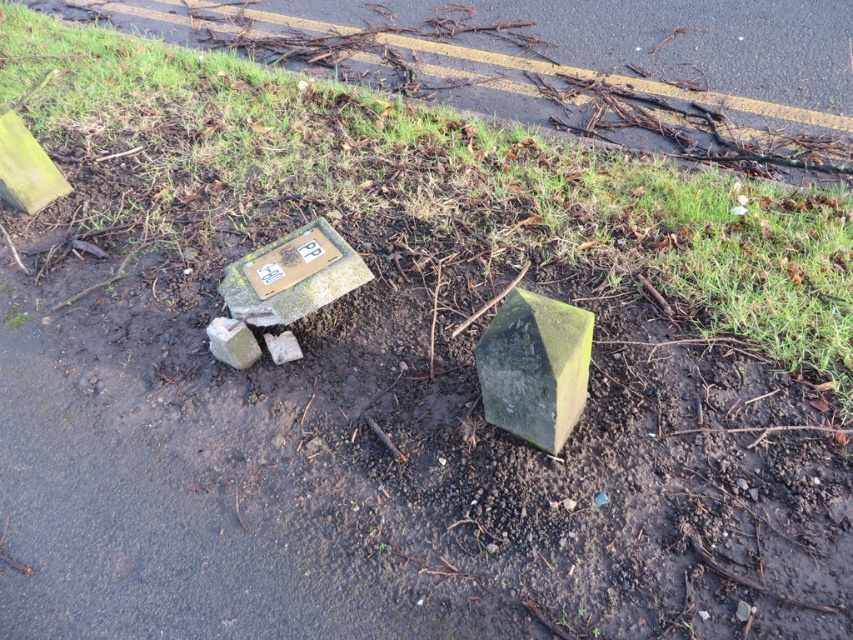
Question: Among these points, which one is farthest from the camera?

Choices:
 (A) (698, 284)
 (B) (531, 323)

Answer: (A)

Question: In this image, where is green grass at upper center located relative to green stone cube at center?

Choices:
 (A) above
 (B) below

Answer: (A)

Question: Does green grass at upper center lie behind green stone cube at center?

Choices:
 (A) no
 (B) yes

Answer: (B)

Question: Considering the relative positions of green grass at upper center and green stone cube at center in the image provided, where is green grass at upper center located with respect to green stone cube at center?

Choices:
 (A) left
 (B) right

Answer: (B)